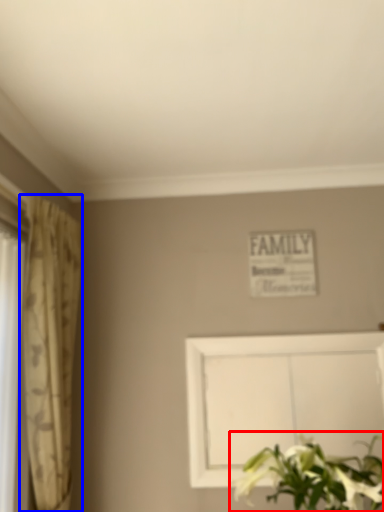
Question: Which object is closer to the camera taking this photo, floral arrangement (highlighted by a red box) or curtain (highlighted by a blue box)?

Choices:
 (A) floral arrangement
 (B) curtain

Answer: (A)